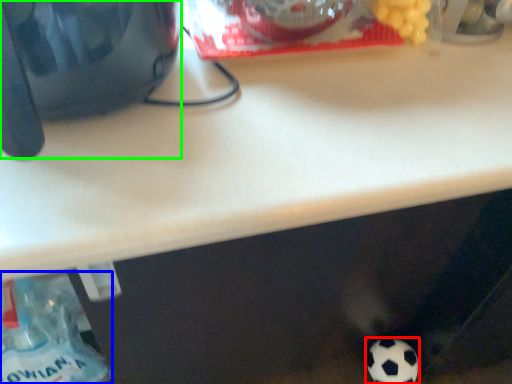
Question: Considering the real-world distances, which object is closest to football (highlighted by a red box)? bottle (highlighted by a blue box) or appliance (highlighted by a green box).

Choices:
 (A) bottle
 (B) appliance

Answer: (A)